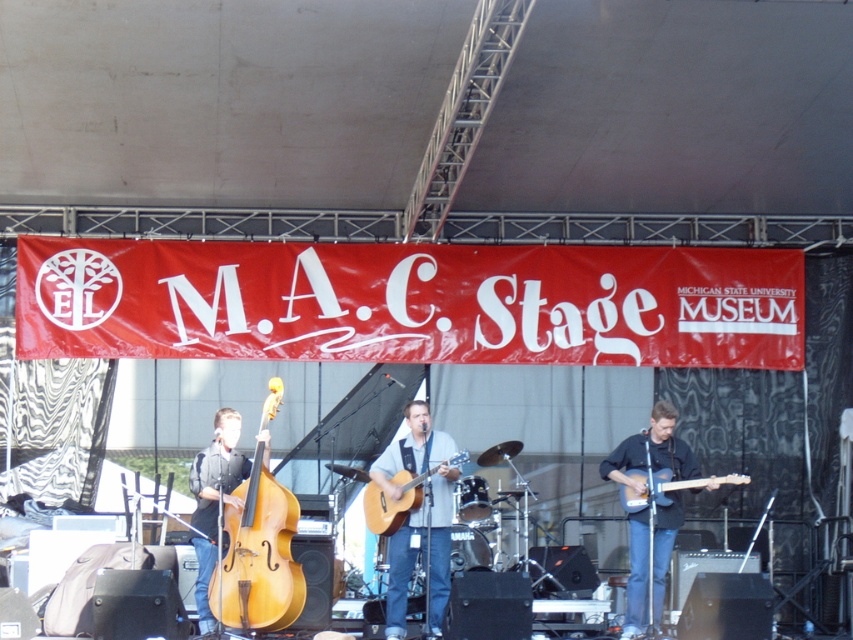
You are standing in front of the stage at the M.A.C. Stage event. There are two points marked on the stage. The first point is at coordinates point (442, 461) and the second point is at point (653, 481). Which point is closer to you?

Point (442, 461) is closer to the viewer than point (653, 481).

You are a photographer at the M.A.C. Stage event. You need to capture a closeup shot of the light brown wood cello at center and dark blue jeans at center. Since the cello is smaller, will you need to adjust your camera focus to ensure both are in frame?

The light brown wood cello at center is smaller than the dark blue jeans at center. To ensure both are in frame, you should adjust your camera focus to accommodate the size difference, making sure the smaller cello and the jeans are both clearly visible.